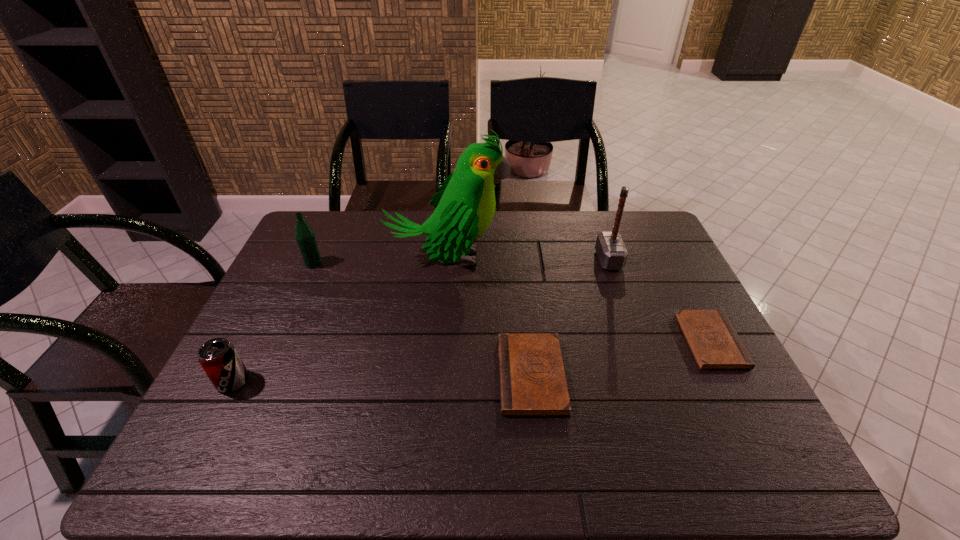
I want to click on empty space that is in between the tallest object and the rightmost object, so click(x=579, y=300).

Identify the location of free space between the right diary and the left diary. This screenshot has height=540, width=960. (621, 358).

Identify the location of object that ranks as the third closest to the shortest object. Image resolution: width=960 pixels, height=540 pixels. (465, 204).

Identify which object is located as the fourth nearest to the fifth object from left to right. Please provide its 2D coordinates. Your answer should be formatted as a tuple, i.e. [(x, y)], where the tuple contains the x and y coordinates of a point satisfying the conditions above.

[(304, 234)]

At what (x,y) coordinates should I click in order to perform the action: click on vacant space that satisfies the following two spatial constraints: 1. on the beak of the parakeet; 2. on the front side of the soda can. Please return your answer as a coordinate pair (x, y). Looking at the image, I should click on coord(436,381).

You are a GUI agent. You are given a task and a screenshot of the screen. Output one action in this format:
    pyautogui.click(x=<x>, y=<y>)
    Task: Click on the free spot that satisfies the following two spatial constraints: 1. on the spine side of the taller diary; 2. on the front side of the leftmost object
    
    Given the screenshot: What is the action you would take?
    pyautogui.click(x=532, y=381)

This screenshot has width=960, height=540. In order to click on free space that satisfies the following two spatial constraints: 1. on the beak of the parakeet; 2. on the front side of the soda can in this screenshot , I will do 436,381.